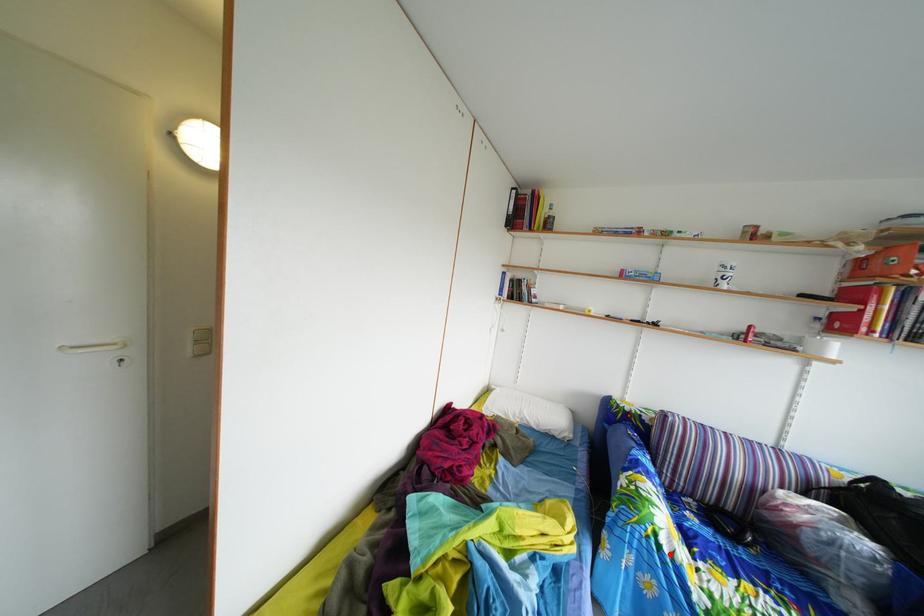
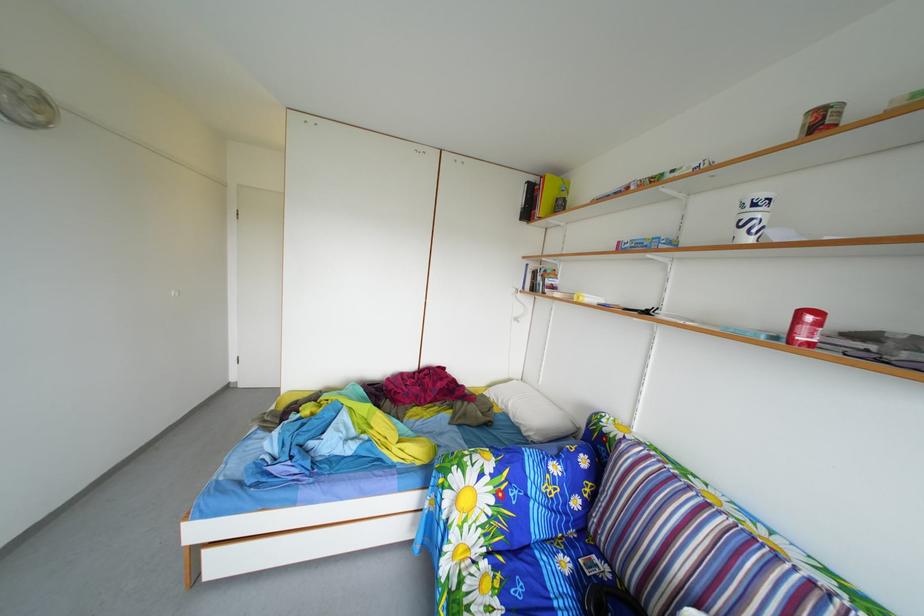
Question: I am providing you with two images of the same scene from different viewpoints. A red point is marked on the first image. Is the red point's position out of view in image 2?

Choices:
 (A) Yes
 (B) No

Answer: (B)